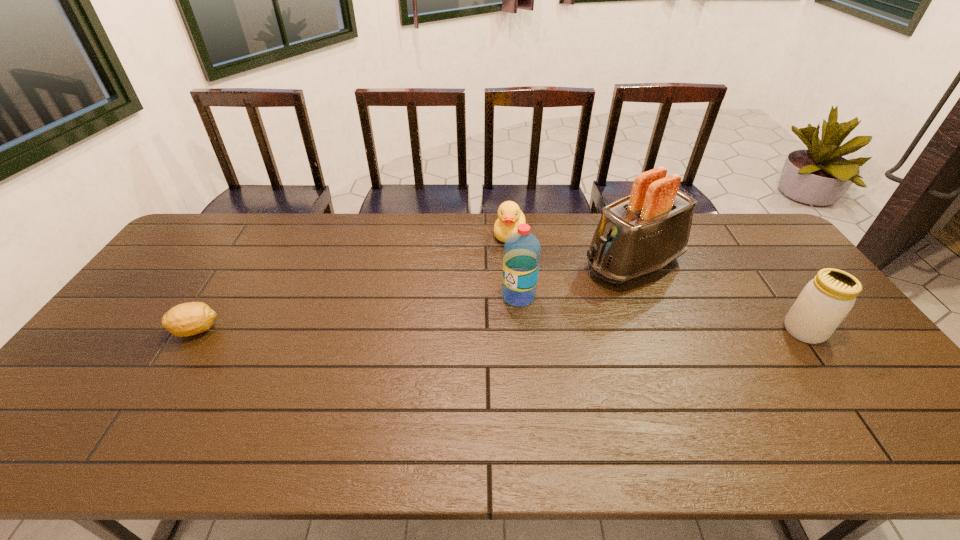
Where is `vacant region that satisfies the following two spatial constraints: 1. on the front side of the fourth tallest object; 2. on the left side of the toaster`? The height and width of the screenshot is (540, 960). vacant region that satisfies the following two spatial constraints: 1. on the front side of the fourth tallest object; 2. on the left side of the toaster is located at coordinates (512, 264).